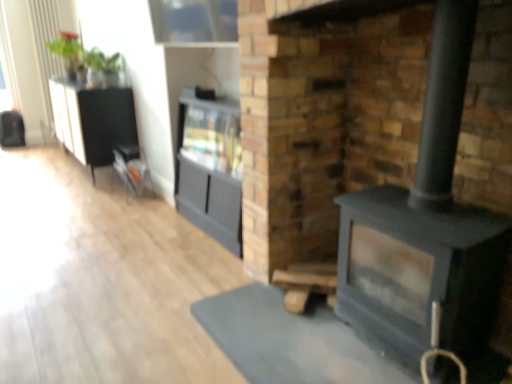
Identify the location of black textured cabinet at left, acting as the second entertainment center starting from the right. (95, 122).

Where is `metallic silver magazine rack at left`? The image size is (512, 384). metallic silver magazine rack at left is located at coordinates (131, 167).

You are a GUI agent. You are given a task and a screenshot of the screen. Output one action in this format:
    pyautogui.click(x=<x>, y=<y>)
    Task: Click on the black textured cabinet at left, which ranks as the 1th entertainment center in back-to-front order
    Image resolution: width=512 pixels, height=384 pixels.
    Given the screenshot: What is the action you would take?
    pyautogui.click(x=95, y=122)

Which of these two, matte black fireplace at center or white glossy radiator at upper left, is smaller?

With smaller size is white glossy radiator at upper left.

Which is behind, point (298, 176) or point (37, 57)?

Positioned behind is point (37, 57).

From the image's perspective, is matte black fireplace at center above or below white glossy radiator at upper left?

matte black fireplace at center is situated lower than white glossy radiator at upper left in the image.

Can you confirm if matte black fireplace at center is taller than white glossy radiator at upper left?

No.

Is metallic silver magazine rack at left positioned far away from matte black fireplace at center?

Yes, metallic silver magazine rack at left is far from matte black fireplace at center.

Looking at the image, does metallic silver magazine rack at left seem bigger or smaller compared to matte black fireplace at center?

Clearly, metallic silver magazine rack at left is smaller in size than matte black fireplace at center.

From a real-world perspective, who is located higher, metallic silver magazine rack at left or matte black fireplace at center?

From a 3D spatial view, matte black fireplace at center is above.

From the picture: From a real-world perspective, is matte black fireplace at center positioned above or below matte gray cabinet at center, the 2th entertainment center in the back-to-front sequence?

matte black fireplace at center is above matte gray cabinet at center, the 2th entertainment center in the back-to-front sequence.

Consider the image. How many degrees apart are the facing directions of matte black fireplace at center and matte gray cabinet at center, arranged as the first entertainment center when viewed from the front?

1.36 degrees separate the facing orientations of matte black fireplace at center and matte gray cabinet at center, arranged as the first entertainment center when viewed from the front.

In the image, is matte black fireplace at center positioned in front of or behind matte gray cabinet at center, the 2th entertainment center in the back-to-front sequence?

Visually, matte black fireplace at center is located in front of matte gray cabinet at center, the 2th entertainment center in the back-to-front sequence.

Do you think matte black fireplace at center is within matte gray cabinet at center, the second entertainment center positioned from the left, or outside of it?

matte black fireplace at center lies outside matte gray cabinet at center, the second entertainment center positioned from the left.

Would you say white glossy radiator at upper left is a long distance from black textured cabinet at left, which ranks as the 1th entertainment center in back-to-front order?

Yes, white glossy radiator at upper left and black textured cabinet at left, which ranks as the 1th entertainment center in back-to-front order, are quite far apart.

Would you say white glossy radiator at upper left is inside or outside black textured cabinet at left, positioned as the 2th entertainment center in front-to-back order?

white glossy radiator at upper left exists outside the volume of black textured cabinet at left, positioned as the 2th entertainment center in front-to-back order.

From a real-world perspective, between white glossy radiator at upper left and black textured cabinet at left, positioned as the 2th entertainment center in front-to-back order, who is vertically higher?

white glossy radiator at upper left.

Considering the sizes of objects white glossy radiator at upper left and black textured cabinet at left, positioned as the 2th entertainment center in front-to-back order, in the image provided, who is bigger, white glossy radiator at upper left or black textured cabinet at left, positioned as the 2th entertainment center in front-to-back order,?

black textured cabinet at left, positioned as the 2th entertainment center in front-to-back order, is bigger.

Is the depth of metallic silver magazine rack at left less than that of white glossy radiator at upper left?

Yes.

Which is further, [142,178] or [49,2]?

Positioned behind is point [49,2].

What's the angular difference between metallic silver magazine rack at left and white glossy radiator at upper left's facing directions?

92.7 degrees separate the facing orientations of metallic silver magazine rack at left and white glossy radiator at upper left.

Based on the photo, from the image's perspective, is metallic silver magazine rack at left over white glossy radiator at upper left?

No, from the image's perspective, metallic silver magazine rack at left is not over white glossy radiator at upper left.

I want to click on radiator behind the matte gray cabinet at center, acting as the 1th entertainment center starting from the right, so click(45, 49).

From a real-world perspective, is matte gray cabinet at center, arranged as the first entertainment center when viewed from the front, over white glossy radiator at upper left?

No, from a real-world perspective, matte gray cabinet at center, arranged as the first entertainment center when viewed from the front, is not on top of white glossy radiator at upper left.

Does matte gray cabinet at center, the 2th entertainment center in the back-to-front sequence, have a lesser height compared to white glossy radiator at upper left?

Yes, matte gray cabinet at center, the 2th entertainment center in the back-to-front sequence, is shorter than white glossy radiator at upper left.

Is black textured cabinet at left, acting as the second entertainment center starting from the right, situated inside matte black fireplace at center or outside?

black textured cabinet at left, acting as the second entertainment center starting from the right, exists outside the volume of matte black fireplace at center.

How far apart are black textured cabinet at left, acting as the second entertainment center starting from the right, and matte black fireplace at center?

black textured cabinet at left, acting as the second entertainment center starting from the right, and matte black fireplace at center are 7.19 feet apart.

Locate an element on the screen. Image resolution: width=512 pixels, height=384 pixels. entertainment center that is the 2nd object located above the matte black fireplace at center (from the image's perspective) is located at coordinates (95, 122).

Which is more distant, (x=79, y=139) or (x=263, y=78)?

Positioned behind is point (x=79, y=139).

In order to click on radiator lying behind the matte black fireplace at center in this screenshot , I will do `click(45, 49)`.

Locate an element on the screen. The height and width of the screenshot is (384, 512). fireplace above the metallic silver magazine rack at left (from a real-world perspective) is located at coordinates (324, 116).

When comparing their distances from matte black fireplace at center, does matte gray cabinet at center, acting as the 1th entertainment center starting from the right, or black textured cabinet at left, which ranks as the 1th entertainment center in back-to-front order, seem further?

Based on the image, black textured cabinet at left, which ranks as the 1th entertainment center in back-to-front order, appears to be further to matte black fireplace at center.

From the image, which object appears to be farther from black textured cabinet at left, marked as the 1th entertainment center in a left-to-right arrangement, matte black fireplace at center or metallic silver magazine rack at left?

matte black fireplace at center is further to black textured cabinet at left, marked as the 1th entertainment center in a left-to-right arrangement.

When comparing their distances from white glossy radiator at upper left, does metallic silver magazine rack at left or black textured cabinet at left, which ranks as the 1th entertainment center in back-to-front order, seem closer?

black textured cabinet at left, which ranks as the 1th entertainment center in back-to-front order, lies closer to white glossy radiator at upper left than the other object.

Considering their positions, is black textured cabinet at left, which ranks as the 1th entertainment center in back-to-front order, positioned closer to white glossy radiator at upper left than metallic silver magazine rack at left?

Among the two, black textured cabinet at left, which ranks as the 1th entertainment center in back-to-front order, is located nearer to white glossy radiator at upper left.

Based on their spatial positions, is black textured cabinet at left, acting as the second entertainment center starting from the right, or matte black fireplace at center closer to white glossy radiator at upper left?

Based on the image, black textured cabinet at left, acting as the second entertainment center starting from the right, appears to be nearer to white glossy radiator at upper left.

Which object lies further to the anchor point black textured cabinet at left, which ranks as the 1th entertainment center in back-to-front order, metallic silver magazine rack at left or white glossy radiator at upper left?

Based on the image, white glossy radiator at upper left appears to be further to black textured cabinet at left, which ranks as the 1th entertainment center in back-to-front order.

Looking at the image, which one is located closer to metallic silver magazine rack at left, white glossy radiator at upper left or black textured cabinet at left, acting as the second entertainment center starting from the right?

black textured cabinet at left, acting as the second entertainment center starting from the right, lies closer to metallic silver magazine rack at left than the other object.

Which object lies nearer to the anchor point white glossy radiator at upper left, black textured cabinet at left, which ranks as the 1th entertainment center in back-to-front order, or matte gray cabinet at center, the second entertainment center positioned from the left?

Among the two, black textured cabinet at left, which ranks as the 1th entertainment center in back-to-front order, is located nearer to white glossy radiator at upper left.

Find the location of a particular element. Image resolution: width=512 pixels, height=384 pixels. furniture located between black textured cabinet at left, which ranks as the 1th entertainment center in back-to-front order, and matte gray cabinet at center, the 2th entertainment center in the back-to-front sequence, in the left-right direction is located at coordinates (131, 167).

You are a GUI agent. You are given a task and a screenshot of the screen. Output one action in this format:
    pyautogui.click(x=<x>, y=<y>)
    Task: Click on the entertainment center positioned between matte gray cabinet at center, acting as the 1th entertainment center starting from the right, and white glossy radiator at upper left from near to far
    This screenshot has width=512, height=384.
    Given the screenshot: What is the action you would take?
    pyautogui.click(x=95, y=122)

The image size is (512, 384). What are the coordinates of `entertainment center positioned between metallic silver magazine rack at left and white glossy radiator at upper left from near to far` in the screenshot? It's located at (95, 122).

Locate an element on the screen. furniture located between matte gray cabinet at center, the 2th entertainment center in the back-to-front sequence, and white glossy radiator at upper left in the depth direction is located at coordinates (131, 167).